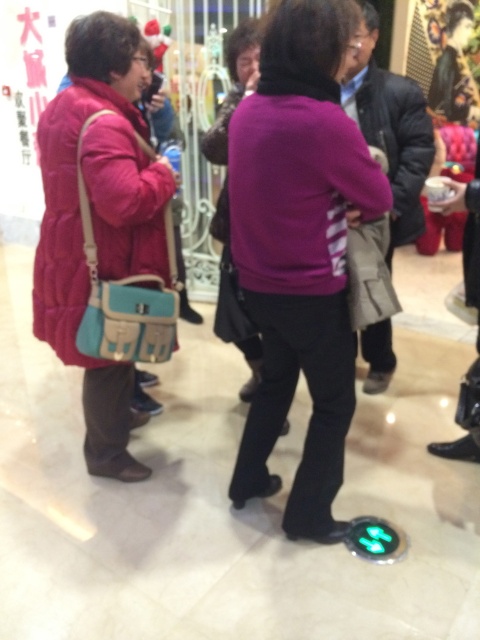
What do you see at coordinates (300, 250) in the screenshot?
I see `purple matte sweater at center` at bounding box center [300, 250].

The height and width of the screenshot is (640, 480). In order to click on purple matte sweater at center in this screenshot , I will do `click(300, 250)`.